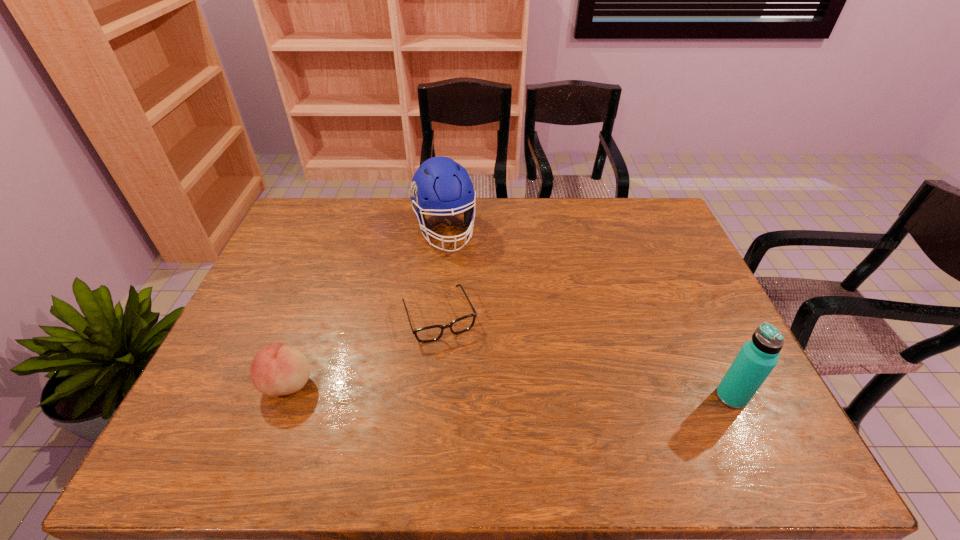
Where is `vacant space on the desktop that is between the leftmost object and the water bottle and is positioned on the front-facing side of the football helmet`? The height and width of the screenshot is (540, 960). vacant space on the desktop that is between the leftmost object and the water bottle and is positioned on the front-facing side of the football helmet is located at coordinates (506, 390).

At what (x,y) coordinates should I click in order to perform the action: click on free space on the desktop that is between the peach and the rightmost object and is positioned on the front-facing side of the shortest object. Please return your answer as a coordinate pair (x, y). Looking at the image, I should click on (469, 389).